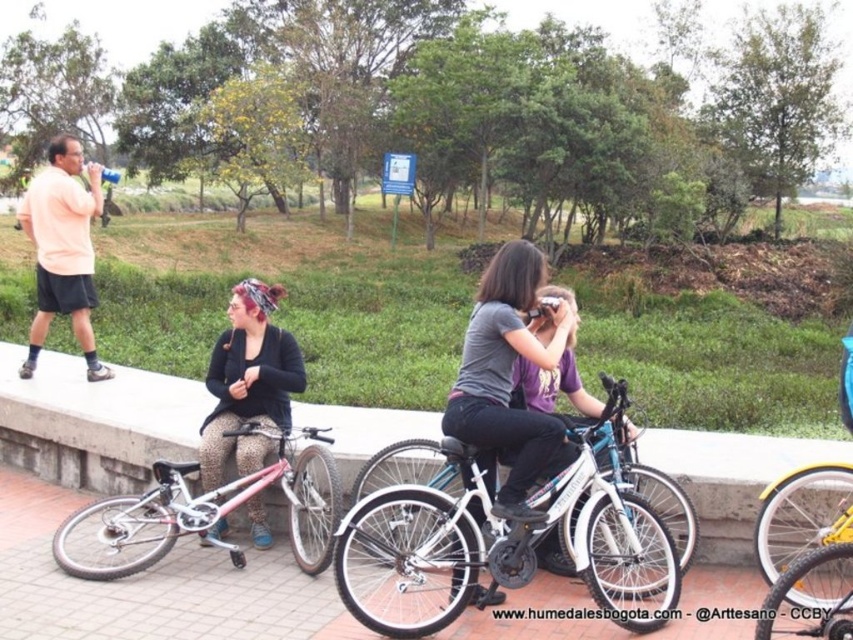
Question: Can you confirm if concrete ledge at center is thinner than yellow matte bicycle at lower right?

Choices:
 (A) yes
 (B) no

Answer: (A)

Question: Which of the following is the farthest from the observer?

Choices:
 (A) yellow matte bicycle at lower right
 (B) leopard print pants at center

Answer: (B)

Question: Observing the image, what is the correct spatial positioning of concrete ledge at center in reference to leopard print pants at center?

Choices:
 (A) above
 (B) below

Answer: (B)

Question: Is white matte bicycle at center further to the viewer compared to yellow matte bicycle at lower right?

Choices:
 (A) no
 (B) yes

Answer: (B)

Question: Estimate the real-world distances between objects in this image. Which object is farther from the yellow matte bicycle at lower right?

Choices:
 (A) leopard print pants at center
 (B) concrete ledge at center

Answer: (A)

Question: Which object is closer to the camera taking this photo?

Choices:
 (A) concrete ledge at center
 (B) yellow matte bicycle at lower right
 (C) pink metallic bicycle at lower left
 (D) leopard print pants at center

Answer: (B)